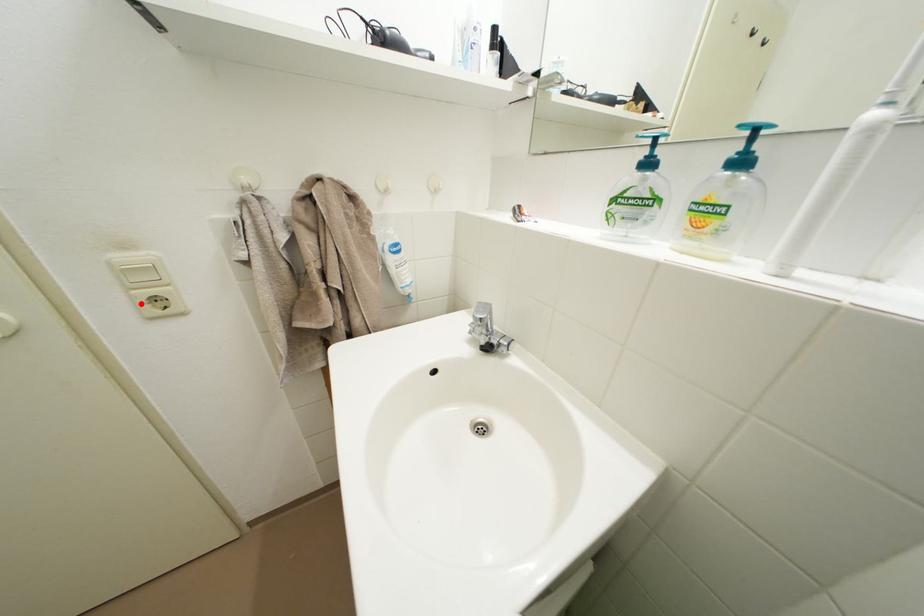
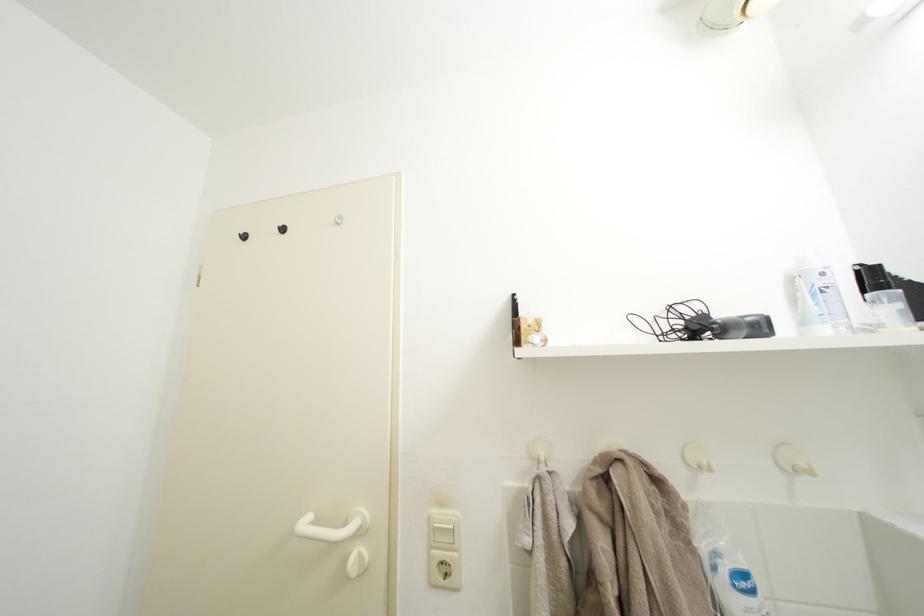
Locate, in the second image, the point that corresponds to the highlighted location in the first image.

(439, 562)